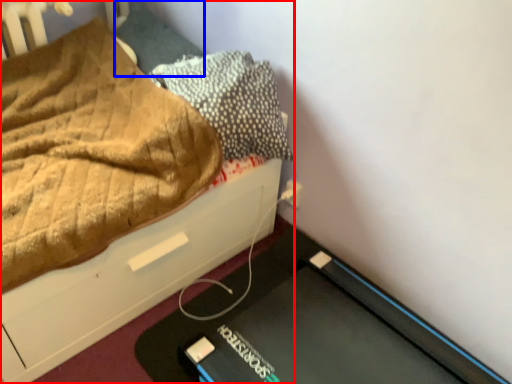
Question: Among these objects, which one is nearest to the camera, bed (highlighted by a red box) or pillow (highlighted by a blue box)?

Choices:
 (A) bed
 (B) pillow

Answer: (A)